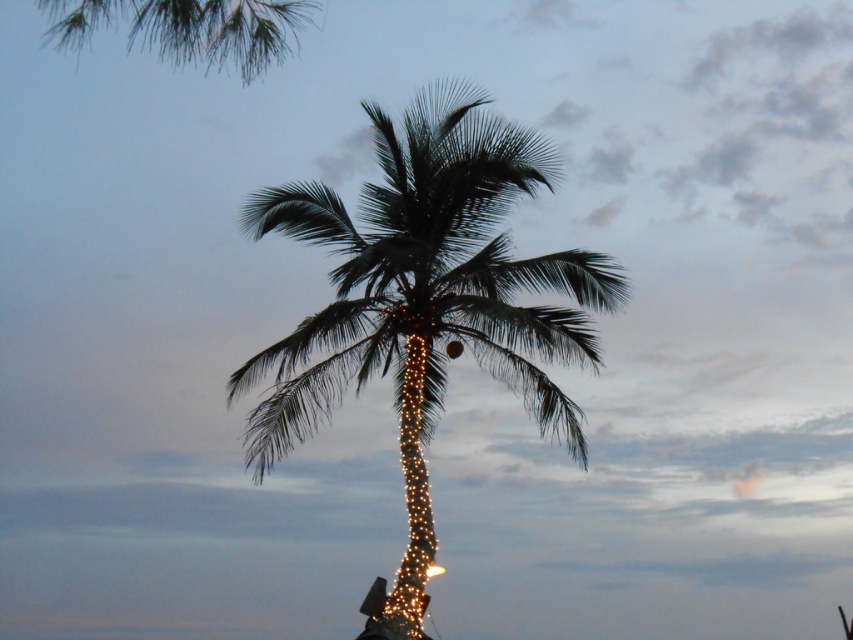
Question: Can you confirm if green leafy palm tree at center is positioned to the left of green leafy palm at upper left?

Choices:
 (A) no
 (B) yes

Answer: (A)

Question: Can you confirm if green leafy palm tree at center is wider than green leafy palm at upper left?

Choices:
 (A) no
 (B) yes

Answer: (A)

Question: Among these objects, which one is farthest from the camera?

Choices:
 (A) green leafy palm at upper left
 (B) green leafy palm tree at center

Answer: (A)

Question: Which of the following is the farthest from the observer?

Choices:
 (A) (90, 10)
 (B) (482, 209)

Answer: (A)

Question: Is green leafy palm tree at center below green leafy palm at upper left?

Choices:
 (A) no
 (B) yes

Answer: (B)